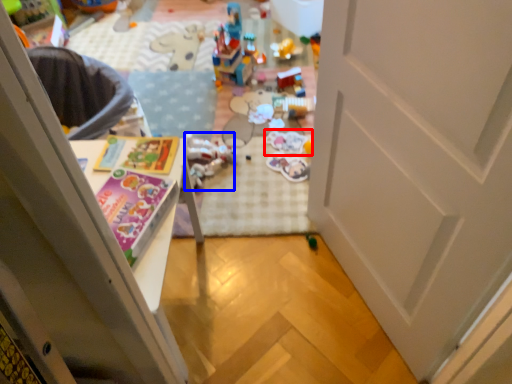
Question: Which object appears farthest to the camera in this image, toy (highlighted by a red box) or toy (highlighted by a blue box)?

Choices:
 (A) toy
 (B) toy

Answer: (A)